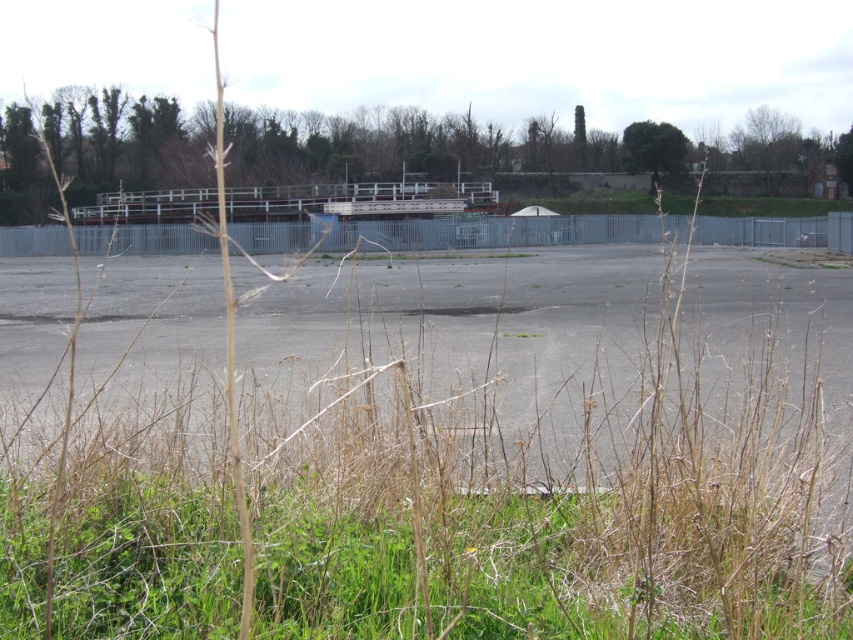
You are a gardener who needs to mow the lawn. You see the green grass at lower center and the gray asphalt parking lot at center. Which area requires mowing, and why?

The green grass at lower center requires mowing because it is grass, while the gray asphalt parking lot at center is an asphalt surface and does not need mowing.

You are standing at the fence in the image and want to walk to the point that is closer to you. Which point should you head towards, point (x=590, y=616) or point (x=511, y=465)?

Point (x=590, y=616) is in front of point (x=511, y=465), so you should head towards point (x=590, y=616) as it is closer to you.